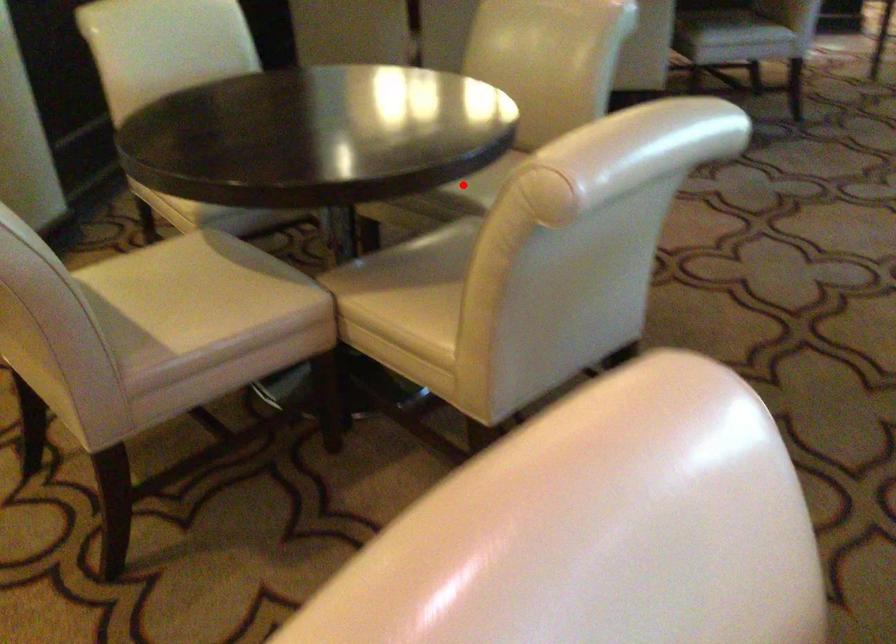
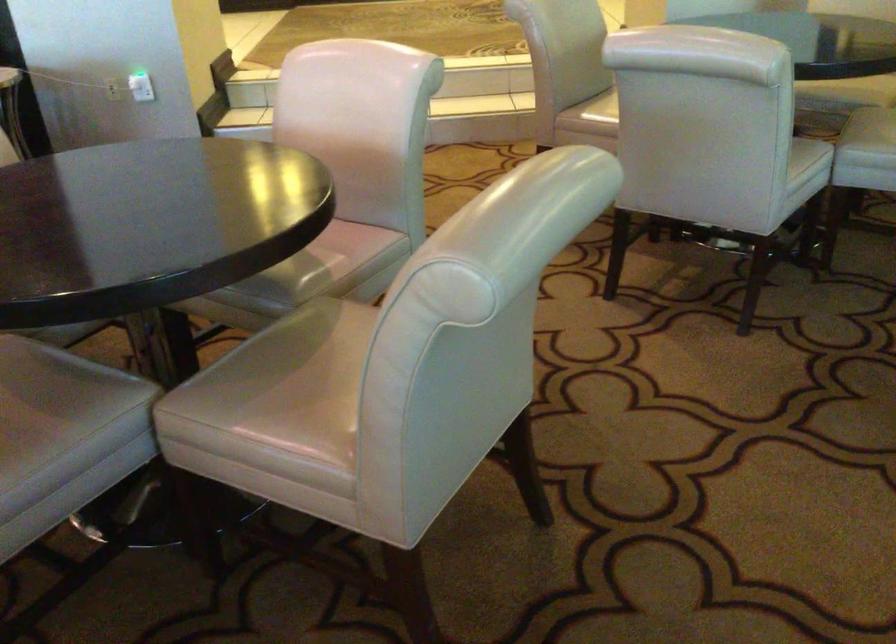
Find the pixel in the second image that matches the highlighted location in the first image.

(874, 125)